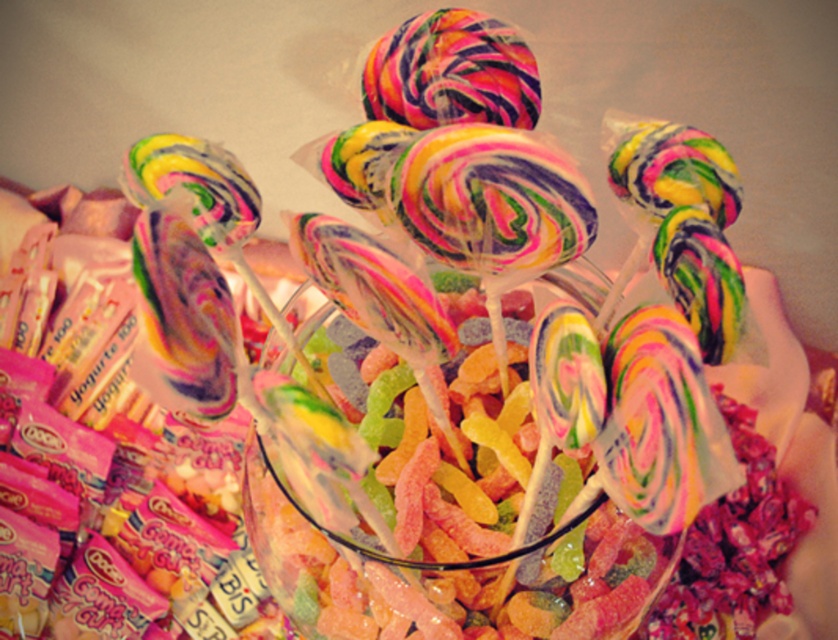
Question: Does transparent glass bowl at center come in front of rainbow swirl lollipop at center?

Choices:
 (A) no
 (B) yes

Answer: (A)

Question: Among these points, which one is farthest from the camera?

Choices:
 (A) (427, 29)
 (B) (303, 557)

Answer: (B)

Question: Which point is closer to the camera?

Choices:
 (A) transparent glass bowl at center
 (B) rainbow swirl lollipop at center

Answer: (B)

Question: Can you confirm if transparent glass bowl at center is thinner than rainbow swirl lollipop at center?

Choices:
 (A) yes
 (B) no

Answer: (B)

Question: Does transparent glass bowl at center appear under rainbow swirl lollipop at center?

Choices:
 (A) no
 (B) yes

Answer: (B)